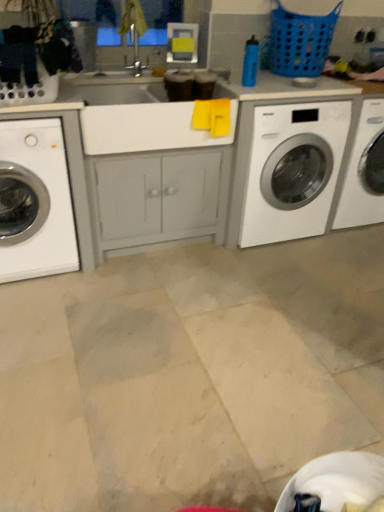
Question: Considering the relative sizes of white glossy washing machine at center right, the 2th washing machine from the left, and blue plastic laundry basket at upper right in the image provided, is white glossy washing machine at center right, the 2th washing machine from the left, thinner than blue plastic laundry basket at upper right?

Choices:
 (A) yes
 (B) no

Answer: (B)

Question: From a real-world perspective, does white glossy washing machine at center right, which is counted as the first washing machine, starting from the right, sit lower than blue plastic laundry basket at upper right?

Choices:
 (A) yes
 (B) no

Answer: (A)

Question: Is white glossy washing machine at center right, the 2th washing machine from the left, at the left side of blue plastic laundry basket at upper right?

Choices:
 (A) no
 (B) yes

Answer: (B)

Question: Is white glossy washing machine at center right, which is counted as the first washing machine, starting from the right, to the right of blue plastic laundry basket at upper right from the viewer's perspective?

Choices:
 (A) yes
 (B) no

Answer: (B)

Question: Considering the relative sizes of white glossy washing machine at center right, which is counted as the first washing machine, starting from the right, and blue plastic laundry basket at upper right in the image provided, is white glossy washing machine at center right, which is counted as the first washing machine, starting from the right, bigger than blue plastic laundry basket at upper right?

Choices:
 (A) no
 (B) yes

Answer: (B)

Question: Relative to blue plastic laundry basket at upper right, is white glossy washing machine at left, which ranks as the 1th washing machine in left-to-right order, in front or behind?

Choices:
 (A) behind
 (B) front

Answer: (B)

Question: Would you say white glossy washing machine at left, which ranks as the 1th washing machine in left-to-right order, is inside or outside blue plastic laundry basket at upper right?

Choices:
 (A) inside
 (B) outside

Answer: (B)

Question: From a real-world perspective, is white glossy washing machine at left, positioned as the second washing machine in right-to-left order, positioned above or below blue plastic laundry basket at upper right?

Choices:
 (A) below
 (B) above

Answer: (A)

Question: From the image's perspective, relative to blue plastic laundry basket at upper right, is white glossy washing machine at left, which ranks as the 1th washing machine in left-to-right order, above or below?

Choices:
 (A) below
 (B) above

Answer: (A)

Question: Considering the positions of point (319, 211) and point (72, 233), is point (319, 211) closer or farther from the camera than point (72, 233)?

Choices:
 (A) closer
 (B) farther

Answer: (B)

Question: Considering the positions of white glossy washing machine at center right, which is counted as the first washing machine, starting from the right, and white glossy washing machine at left, which ranks as the 1th washing machine in left-to-right order, in the image, is white glossy washing machine at center right, which is counted as the first washing machine, starting from the right, taller or shorter than white glossy washing machine at left, which ranks as the 1th washing machine in left-to-right order,?

Choices:
 (A) tall
 (B) short

Answer: (A)

Question: Is white glossy washing machine at center right, which is counted as the first washing machine, starting from the right, in front of or behind white glossy washing machine at left, which ranks as the 1th washing machine in left-to-right order, in the image?

Choices:
 (A) front
 (B) behind

Answer: (B)

Question: From the image's perspective, is white glossy washing machine at center right, which is counted as the first washing machine, starting from the right, located above or below white glossy washing machine at left, which ranks as the 1th washing machine in left-to-right order?

Choices:
 (A) below
 (B) above

Answer: (B)

Question: Is blue plastic laundry basket at upper right spatially inside white glossy washing machine at center right, which is counted as the first washing machine, starting from the right, or outside of it?

Choices:
 (A) inside
 (B) outside

Answer: (B)

Question: Considering the positions of blue plastic laundry basket at upper right and white glossy washing machine at center right, which is counted as the first washing machine, starting from the right, in the image, is blue plastic laundry basket at upper right wider or thinner than white glossy washing machine at center right, which is counted as the first washing machine, starting from the right,?

Choices:
 (A) thin
 (B) wide

Answer: (A)